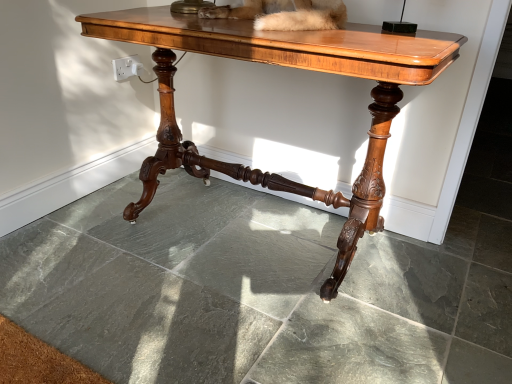
Find the location of a particular element. The image size is (512, 384). free point in front of shiny wood table at center is located at coordinates (227, 328).